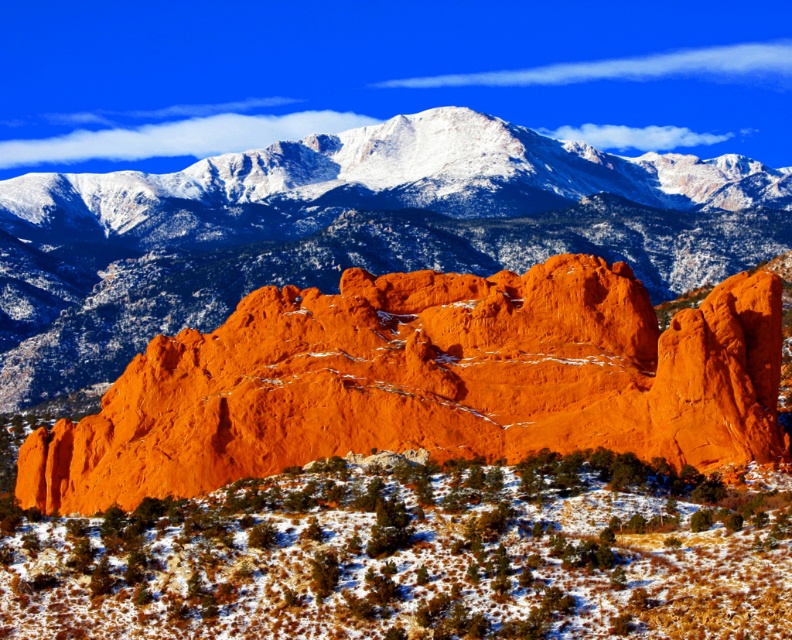
Based on the photo, you are standing in the Garden of the Gods and notice two orange rock features in front of you. The first is a matte orange rock at center, and the second is an orange rock formation at center. According to the scene description, which of these two objects is positioned lower in the image?

The matte orange rock at center is located below the orange rock formation at center, so it is positioned lower in the image.

Based on the photo, you are a hiker planning to take a photo of the matte orange rock at center and the orange rock formation at center. Which object should you move closer to in order to capture both in a single frame without zooming in?

To capture both the matte orange rock at center and the orange rock formation at center in a single frame without zooming in, you should move closer to the matte orange rock at center because it is smaller than the orange rock formation at center.

Consider the image. You are a hiker planning to take a photo of the matte orange rock at center and the orange rock formation at center. Which one should you stand closer to in order to capture both in the same frame?

You should stand closer to the matte orange rock at center because it is shorter than the orange rock formation at center, allowing both to be included in the frame when positioned nearer to the smaller object.